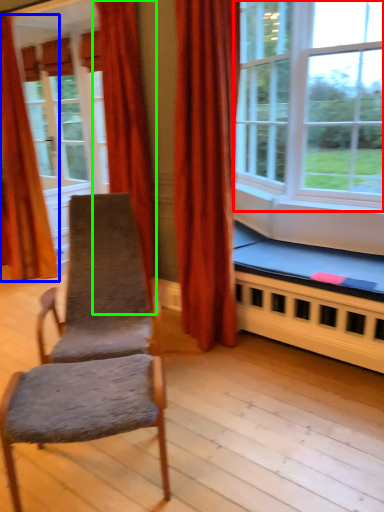
Question: Which is farther away from window (highlighted by a red box)? curtain (highlighted by a blue box) or curtain (highlighted by a green box)?

Choices:
 (A) curtain
 (B) curtain

Answer: (A)